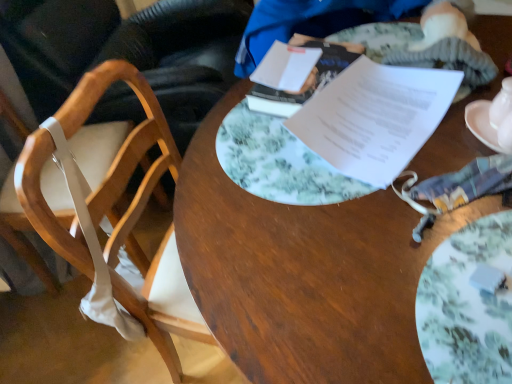
The image size is (512, 384). What are the coordinates of `free space between white paper at center, marked as the 1th journal in a front-to-back arrangement, and white ceramic saucer at right` in the screenshot? It's located at (454, 162).